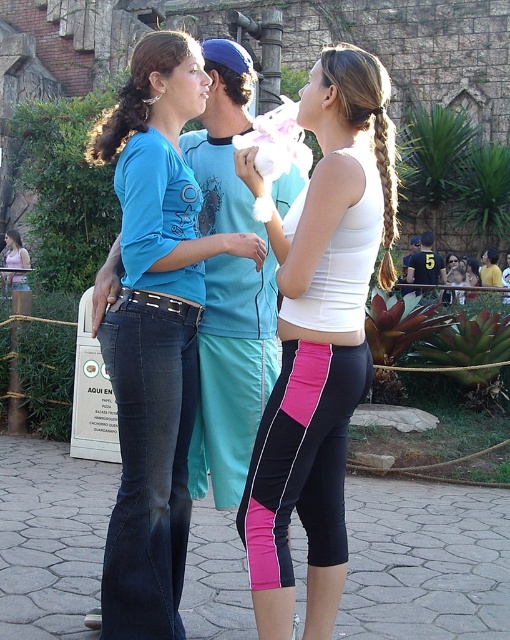
Is white matte tank top at center bigger than matte blue shirt at center?

No, white matte tank top at center is not bigger than matte blue shirt at center.

Is white matte tank top at center further to the viewer compared to matte blue shirt at center?

No.

Is point (306, 477) positioned before point (164, 216)?

Yes, it is in front of point (164, 216).

You are a GUI agent. You are given a task and a screenshot of the screen. Output one action in this format:
    pyautogui.click(x=<x>, y=<y>)
    Task: Click on the white matte tank top at center
    
    Given the screenshot: What is the action you would take?
    pyautogui.click(x=320, y=340)

Does white matte tank top at center appear over dark blue denim jeans at left?

Correct, white matte tank top at center is located above dark blue denim jeans at left.

Between point (299, 92) and point (157, 321), which one is positioned in front?

Point (157, 321) is in front.

Find the location of a particular element. white matte tank top at center is located at coordinates (320, 340).

Is point (145, 616) positioned in front of point (338, 536)?

Yes, point (145, 616) is in front of point (338, 536).

What do you see at coordinates (148, 461) in the screenshot? I see `dark blue denim jeans at left` at bounding box center [148, 461].

The height and width of the screenshot is (640, 510). Find the location of `dark blue denim jeans at left`. dark blue denim jeans at left is located at coordinates (148, 461).